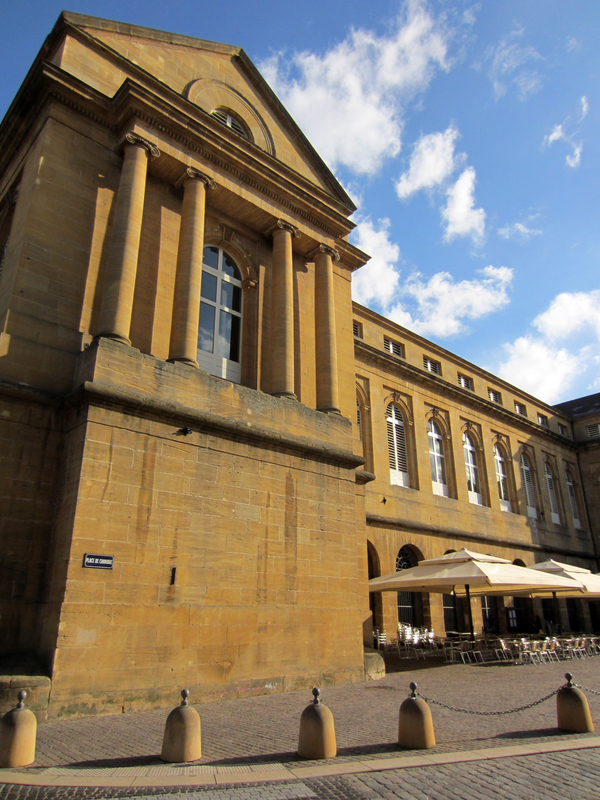
What are the coordinates of `cover` in the screenshot? It's located at (505, 570).